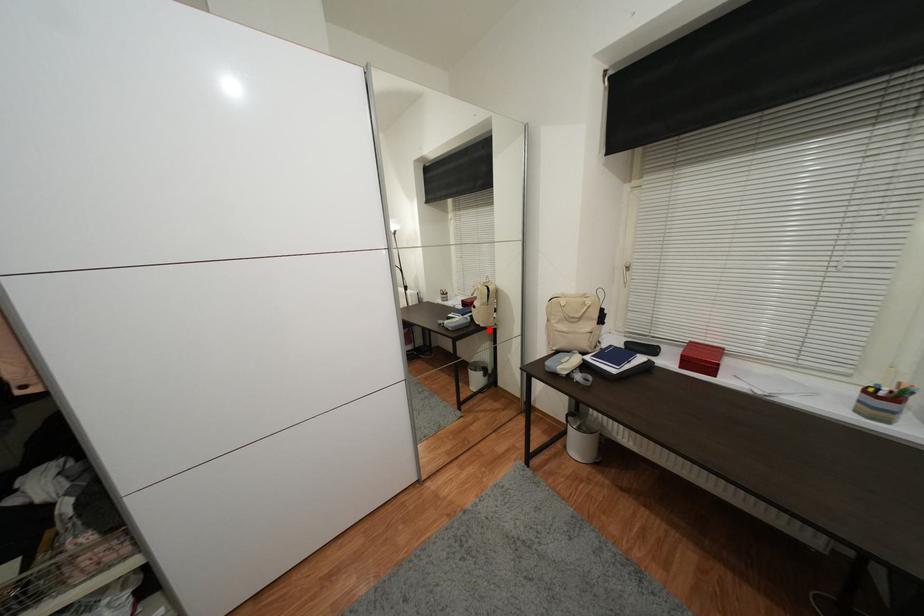
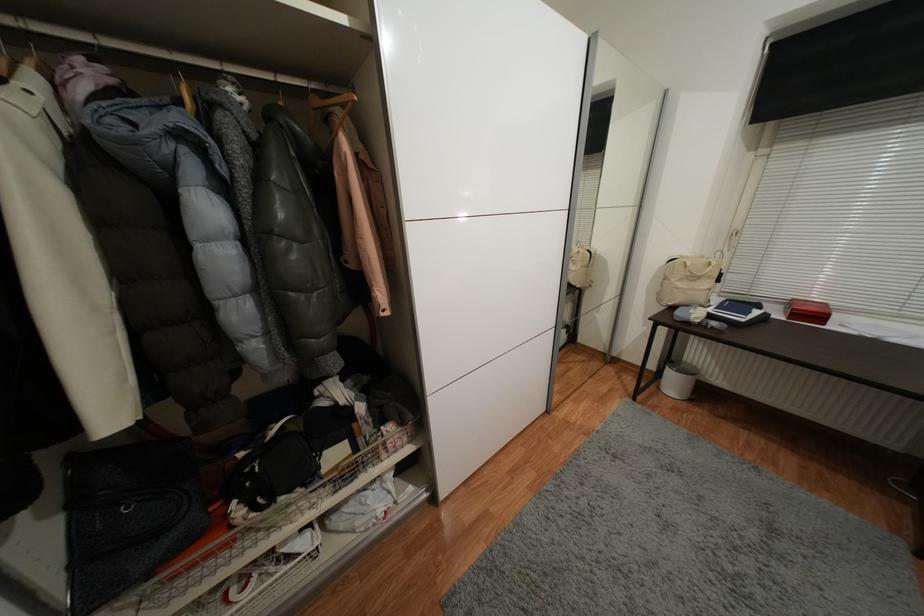
Question: I am providing you with two images of the same scene from different viewpoints. Image1 has a red point marked. In image2, the corresponding 3D location appears at what relative position? Reply with the corresponding letter.

Choices:
 (A) Closer
 (B) Farther

Answer: (B)